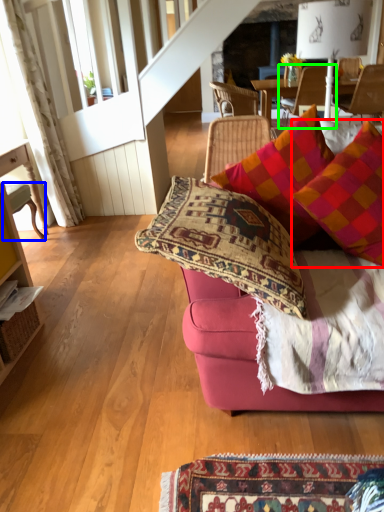
Question: Based on their relative distances, which object is nearer to pillow (highlighted by a red box)? Choose from chair (highlighted by a blue box) and chair (highlighted by a green box).

Choices:
 (A) chair
 (B) chair

Answer: (A)